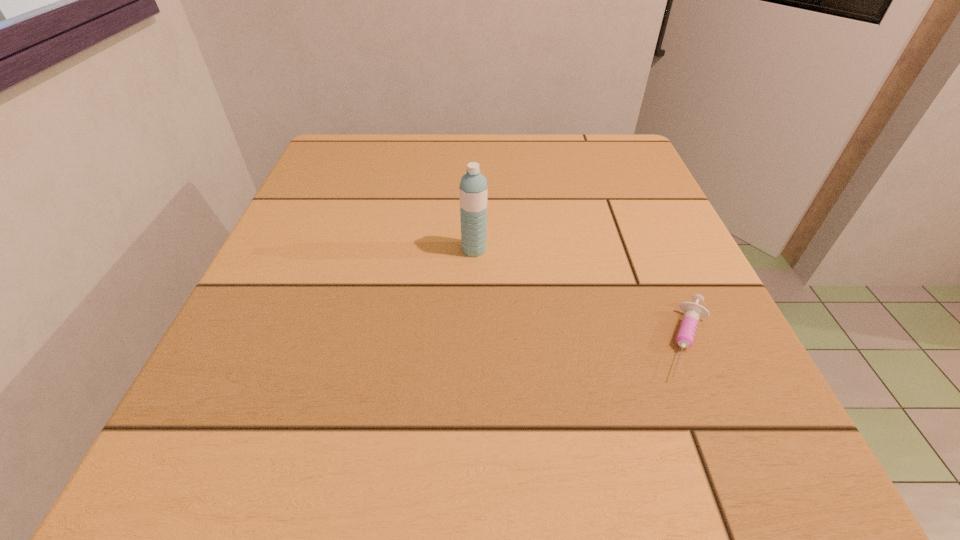
What are the coordinates of `vacant space at the right edge of the desktop` in the screenshot? It's located at (636, 200).

You are a GUI agent. You are given a task and a screenshot of the screen. Output one action in this format:
    pyautogui.click(x=<x>, y=<y>)
    Task: Click on the blank space at the far left corner of the desktop
    
    Given the screenshot: What is the action you would take?
    pyautogui.click(x=386, y=167)

This screenshot has width=960, height=540. I want to click on vacant area at the far right corner, so click(579, 174).